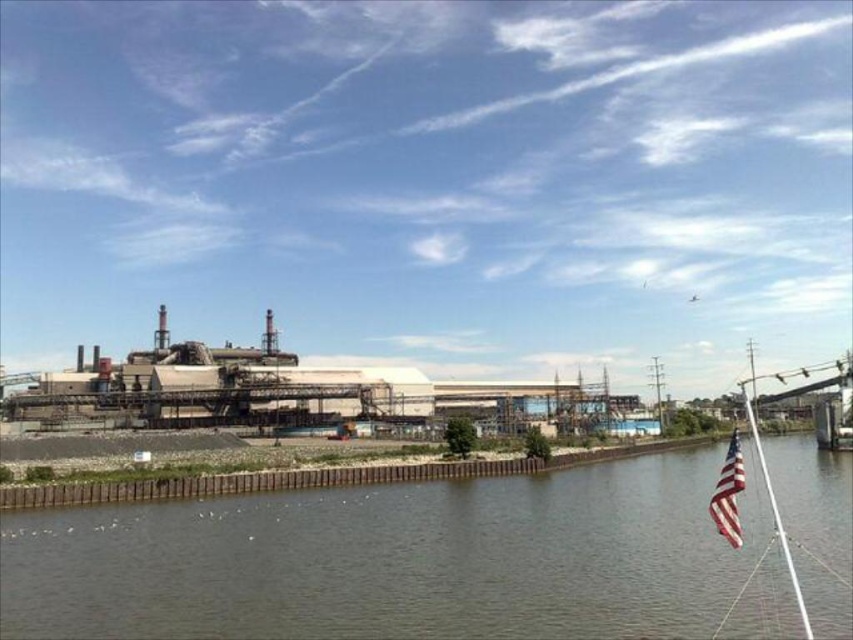
You are a drone operator tasked with capturing aerial footage of the brown concrete river at lower center and the industrial gray concrete factory at center. From the drone camera view, which object appears closer to the bottom edge of the screen?

The brown concrete river at lower center appears closer to the bottom edge of the screen because it is located below the industrial gray concrete factory at center.

You are an engineer inspecting the industrial complex from the water. You notice the brown concrete river at lower center and the white plastic mast at right. Which object appears larger in the image?

The white plastic mast at right appears larger than the brown concrete river at lower center because the brown concrete river at lower center is smaller than the white plastic mast at right.

You are a photographer planning to capture the industrial complex and the boat in one shot. Given that the industrial gray concrete factory at center and the american flag at right must both be visible, which object should you focus on first to ensure both are in frame?

You should focus on the industrial gray concrete factory at center first because it is larger than the american flag at right, ensuring it fits within the frame while still allowing space for the smaller flag.